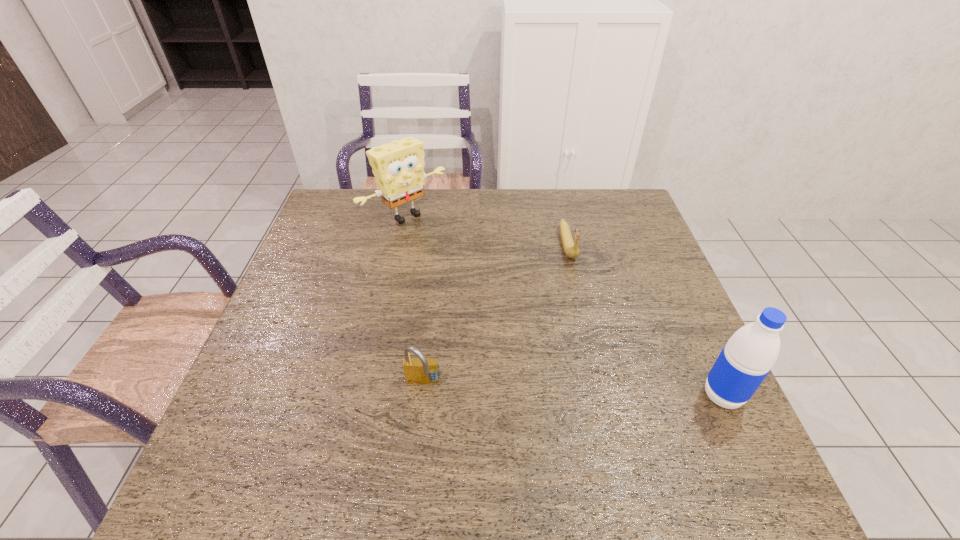
The width and height of the screenshot is (960, 540). Identify the location of vacant point at the near edge. (404, 411).

Locate an element on the screen. The image size is (960, 540). vacant space at the left edge of the desktop is located at coordinates (317, 268).

Image resolution: width=960 pixels, height=540 pixels. I want to click on vacant space at the right edge of the desktop, so click(x=677, y=297).

Where is `free space at the far left corner of the desktop`? Image resolution: width=960 pixels, height=540 pixels. free space at the far left corner of the desktop is located at coordinates (352, 212).

In the image, there is a desktop. Identify the location of free space at the near left corner. (280, 418).

Where is `free space at the near right corner of the desktop`? free space at the near right corner of the desktop is located at coordinates (727, 430).

This screenshot has height=540, width=960. Find the location of `vacant point located between the padlock and the sponge`. vacant point located between the padlock and the sponge is located at coordinates (415, 300).

Locate an element on the screen. unoccupied position between the padlock and the rightmost object is located at coordinates coord(573,390).

You are a GUI agent. You are given a task and a screenshot of the screen. Output one action in this format:
    pyautogui.click(x=<x>, y=<y>)
    Task: Click on the vacant area that lies between the sponge and the third object from left to right
    Image resolution: width=960 pixels, height=540 pixels.
    Given the screenshot: What is the action you would take?
    pyautogui.click(x=487, y=230)

Find the location of a particular element. The width and height of the screenshot is (960, 540). free spot between the banana and the rightmost object is located at coordinates (645, 320).